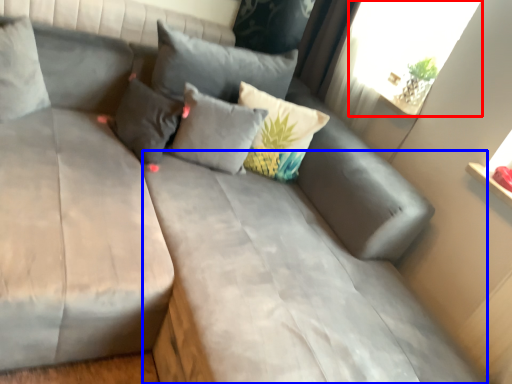
Question: Which object appears closest to the camera in this image, window screen (highlighted by a red box) or mattress (highlighted by a blue box)?

Choices:
 (A) window screen
 (B) mattress

Answer: (B)